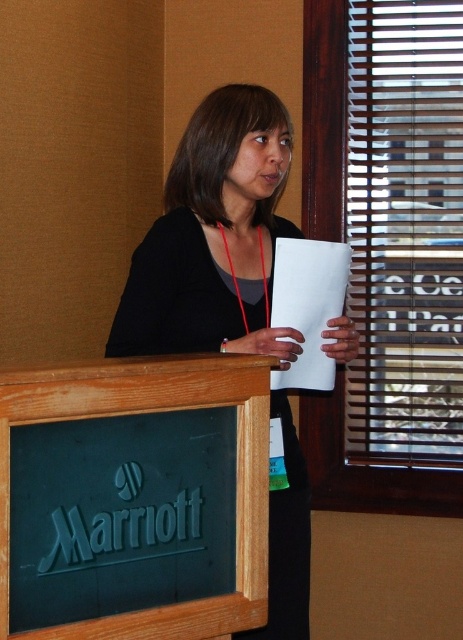
Measure the distance between point [275,417] and camera.

They are 1.80 meters apart.

At what (x,y) coordinates should I click in order to perform the action: click on black matte paper at center. Please return your answer as a coordinate pair (x, y). Looking at the image, I should click on (213, 237).